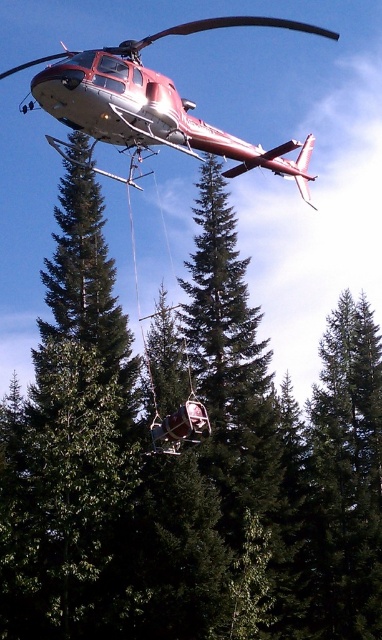
You are a pilot flying the red helicopter in the scene. You need to lower the rescue basket to the ground near the green textured tree at center. Based on the coordinates provided, can you confirm if the tree is positioned in the lower half of the image?

The green textured tree at center is located at point coordinates with a y value of 0.178. Since the y coordinate ranges from 0 at the bottom to 1 at the top, a value of 0.178 places it closer to the bottom. Therefore, the tree is in the lower half of the image.

You are a rescue worker observing the scene from the helicopter. You notice the green textured tree at center and the metallic silver ski lift at center. Which object appears bigger in the image?

The green textured tree at center is larger in size than the metallic silver ski lift at center, so the green textured tree at center appears bigger in the image.

You are a pilot flying a metallic red helicopter at upper center. You need to lower the rescue basket to the ground near a metallic silver ski lift at center. Is there enough space between the helicopter and the ski lift to safely lower the basket without collision?

The metallic red helicopter at upper center might be wider than the metallic silver ski lift at center, so there may not be enough space to safely lower the basket without risking collision. Assess the width difference and adjust the approach accordingly.